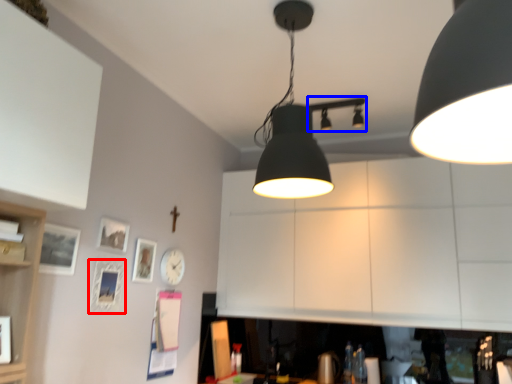
Question: Which object appears farthest to the camera in this image, picture frame (highlighted by a red box) or lamp (highlighted by a blue box)?

Choices:
 (A) picture frame
 (B) lamp

Answer: (B)